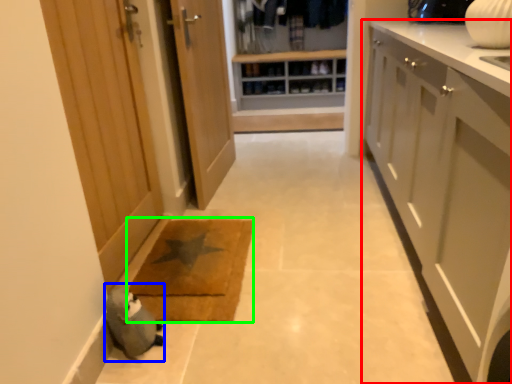
Question: Which object is the closest to the cabinetry (highlighted by a red box)? Choose among these: animal (highlighted by a blue box) or mat (highlighted by a green box).

Choices:
 (A) animal
 (B) mat

Answer: (B)